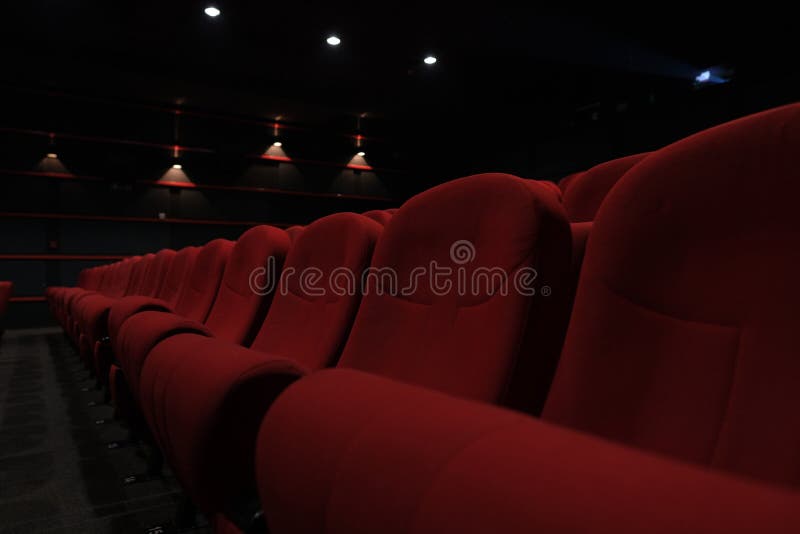
What are the coordinates of `round lights in row` in the screenshot? It's located at (208, 13), (332, 42), (430, 62), (704, 77).